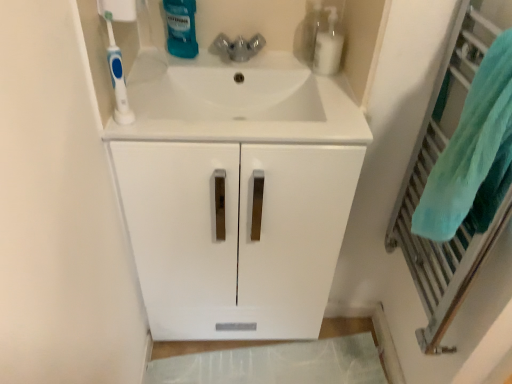
Question: Does clear plastic bottle at upper right, the 1th cleaning product positioned from the right, have a lesser width compared to white glossy sink at center?

Choices:
 (A) yes
 (B) no

Answer: (A)

Question: Is clear plastic bottle at upper right, marked as the second cleaning product in a left-to-right arrangement, wider than white glossy sink at center?

Choices:
 (A) yes
 (B) no

Answer: (B)

Question: From a real-world perspective, is clear plastic bottle at upper right, marked as the second cleaning product in a left-to-right arrangement, physically below white glossy sink at center?

Choices:
 (A) no
 (B) yes

Answer: (A)

Question: Is the position of clear plastic bottle at upper right, marked as the second cleaning product in a left-to-right arrangement, more distant than that of white glossy sink at center?

Choices:
 (A) no
 (B) yes

Answer: (B)

Question: From the image's perspective, is clear plastic bottle at upper right, marked as the second cleaning product in a left-to-right arrangement, over white glossy sink at center?

Choices:
 (A) no
 (B) yes

Answer: (B)

Question: Is white glossy sink at center surrounded by clear plastic bottle at upper right, marked as the second cleaning product in a left-to-right arrangement?

Choices:
 (A) yes
 (B) no

Answer: (B)

Question: Is white glossy sink at center far from translucent plastic mouthwash at upper center, the first cleaning product positioned from the left?

Choices:
 (A) yes
 (B) no

Answer: (B)

Question: Is white glossy sink at center to the left of translucent plastic mouthwash at upper center, which is the second cleaning product in right-to-left order, from the viewer's perspective?

Choices:
 (A) yes
 (B) no

Answer: (B)

Question: Can you confirm if white glossy sink at center is bigger than translucent plastic mouthwash at upper center, the first cleaning product positioned from the left?

Choices:
 (A) no
 (B) yes

Answer: (B)

Question: Is white glossy sink at center looking in the opposite direction of translucent plastic mouthwash at upper center, which is the second cleaning product in right-to-left order?

Choices:
 (A) no
 (B) yes

Answer: (A)

Question: From a real-world perspective, is white glossy sink at center under translucent plastic mouthwash at upper center, which is the second cleaning product in right-to-left order?

Choices:
 (A) yes
 (B) no

Answer: (A)

Question: From the image's perspective, is white glossy sink at center over translucent plastic mouthwash at upper center, which is the second cleaning product in right-to-left order?

Choices:
 (A) yes
 (B) no

Answer: (B)

Question: Is white matte cabinet at center positioned behind translucent plastic mouthwash at upper center, the first cleaning product positioned from the left?

Choices:
 (A) no
 (B) yes

Answer: (A)